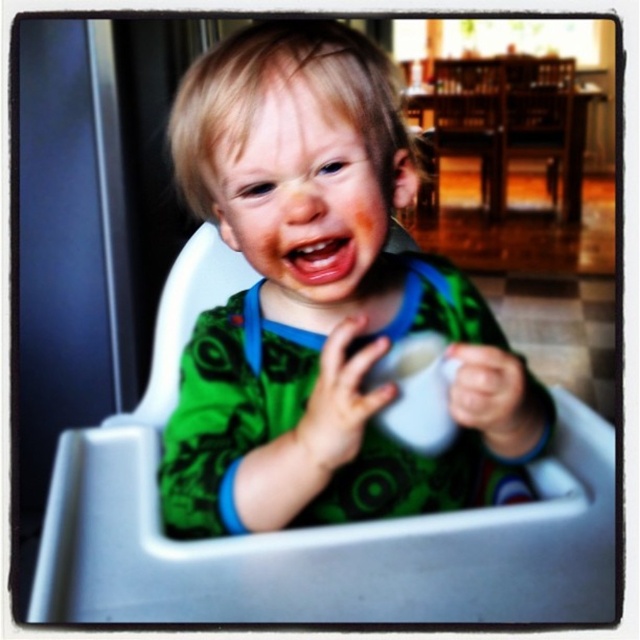
Measure the distance between point [289,316] and camera.

Point [289,316] and camera are 68.70 centimeters apart from each other.

Is point (282, 456) farther from camera compared to point (125, 493)?

No, it is in front of (125, 493).

Is point (472, 324) closer to viewer compared to point (582, 502)?

That is False.

The image size is (640, 640). Find the location of `green matte shirt at center`. green matte shirt at center is located at coordinates (321, 301).